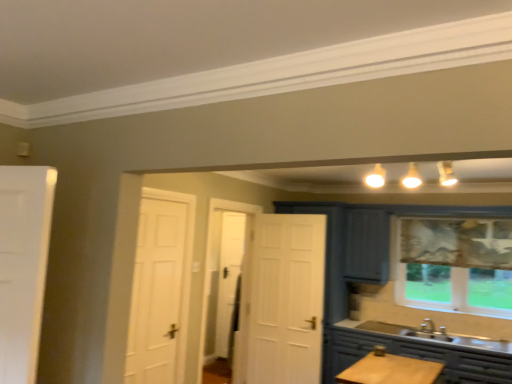
Question: Is transparent fabric window at right inside the boundaries of matte gray cabinet at lower right, or outside?

Choices:
 (A) inside
 (B) outside

Answer: (B)

Question: From the image's perspective, is transparent fabric window at right above or below matte gray cabinet at lower right?

Choices:
 (A) above
 (B) below

Answer: (A)

Question: Considering their positions, is transparent fabric window at right located in front of or behind matte gray cabinet at lower right?

Choices:
 (A) front
 (B) behind

Answer: (B)

Question: In the image, is matte gray cabinet at lower right on the left side or the right side of transparent fabric window at right?

Choices:
 (A) right
 (B) left

Answer: (B)

Question: Is matte gray cabinet at lower right wider or thinner than transparent fabric window at right?

Choices:
 (A) wide
 (B) thin

Answer: (A)

Question: Based on their sizes in the image, would you say matte gray cabinet at lower right is bigger or smaller than transparent fabric window at right?

Choices:
 (A) small
 (B) big

Answer: (B)

Question: Is matte gray cabinet at lower right taller or shorter than transparent fabric window at right?

Choices:
 (A) tall
 (B) short

Answer: (B)